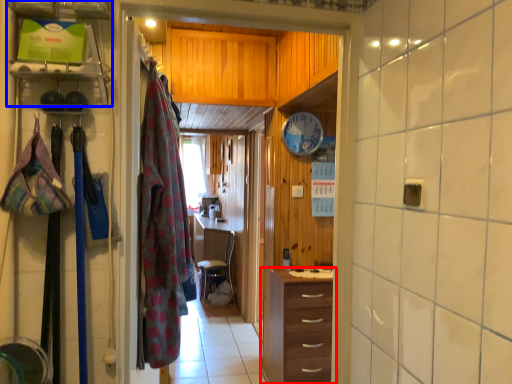
Question: Which object appears farthest to the camera in this image, chest of drawers (highlighted by a red box) or shelf (highlighted by a blue box)?

Choices:
 (A) chest of drawers
 (B) shelf

Answer: (A)